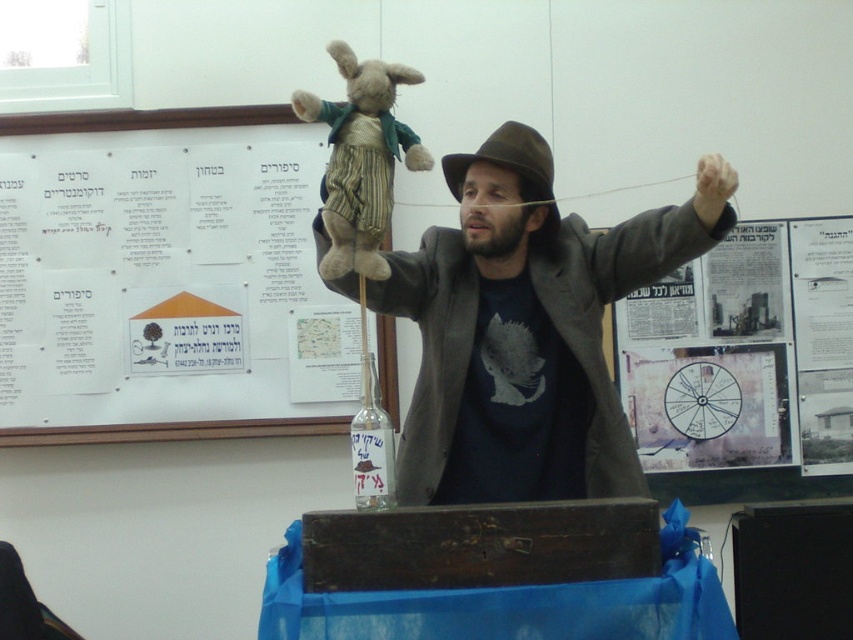
Consider the image. Measure the distance from white paper at upper left to brown felt fedora at center.

The distance of white paper at upper left from brown felt fedora at center is 3.93 feet.

Does white paper at upper left appear on the right side of brown felt fedora at center?

No, white paper at upper left is not to the right of brown felt fedora at center.

Describe the element at coordinates (167, 289) in the screenshot. The image size is (853, 640). I see `white paper at upper left` at that location.

What are the coordinates of `white paper at upper left` in the screenshot? It's located at (167, 289).

Can you confirm if matte paper poster at center is smaller than transparent glass bottle at center?

No, matte paper poster at center is not smaller than transparent glass bottle at center.

Is the position of matte paper poster at center less distant than that of transparent glass bottle at center?

No, it is not.

Identify the location of matte paper poster at center. The height and width of the screenshot is (640, 853). (708, 406).

Is white paper at upper left thinner than fuzzy brown teddy bear at upper center?

In fact, white paper at upper left might be wider than fuzzy brown teddy bear at upper center.

Consider the image. Can you confirm if white paper at upper left is taller than fuzzy brown teddy bear at upper center?

Yes.

This screenshot has width=853, height=640. Describe the element at coordinates (167, 289) in the screenshot. I see `white paper at upper left` at that location.

This screenshot has width=853, height=640. In order to click on white paper at upper left in this screenshot , I will do `click(167, 289)`.